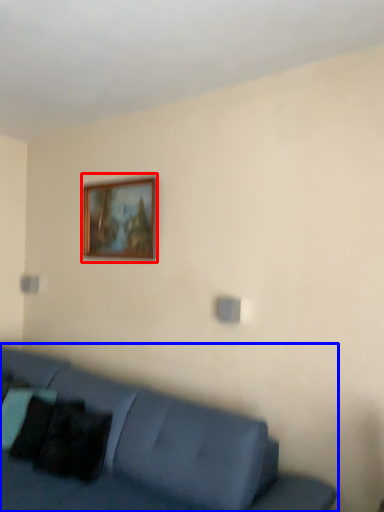
Question: Which point is closer to the camera, picture frame (highlighted by a red box) or studio couch (highlighted by a blue box)?

Choices:
 (A) picture frame
 (B) studio couch

Answer: (B)